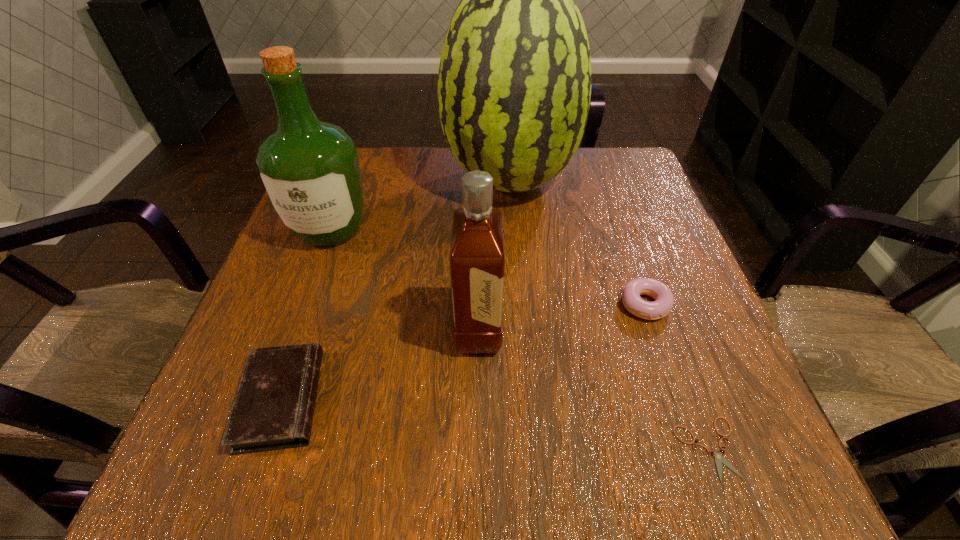
The width and height of the screenshot is (960, 540). Find the location of `watermelon`. watermelon is located at coordinates (514, 83).

Image resolution: width=960 pixels, height=540 pixels. I want to click on the farther liquor, so click(310, 169).

You are a GUI agent. You are given a task and a screenshot of the screen. Output one action in this format:
    pyautogui.click(x=<x>, y=<y>)
    Task: Click on the taller liquor
    This screenshot has width=960, height=540.
    Given the screenshot: What is the action you would take?
    pyautogui.click(x=310, y=169)

I want to click on the nearer liquor, so click(477, 263).

The width and height of the screenshot is (960, 540). In order to click on the shorter liquor in this screenshot , I will do `click(477, 263)`.

Identify the location of doughnut. Image resolution: width=960 pixels, height=540 pixels. (664, 299).

The image size is (960, 540). Identify the location of diary. (274, 405).

The width and height of the screenshot is (960, 540). What are the coordinates of `shears` in the screenshot? It's located at (719, 459).

This screenshot has height=540, width=960. I want to click on free space located 0.150m on the front of the watermelon, so click(516, 269).

Locate an element on the screen. free space located on the front-facing side of the left liquor is located at coordinates (302, 306).